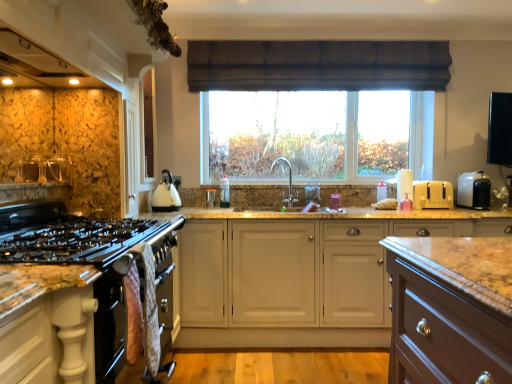
Question: Are white plastic toaster at right, the 2th appliance from the left, and brown fabric curtain at upper center located far from each other?

Choices:
 (A) no
 (B) yes

Answer: (B)

Question: Does white plastic toaster at right, marked as the first appliance in a right-to-left arrangement, have a lesser height compared to brown fabric curtain at upper center?

Choices:
 (A) yes
 (B) no

Answer: (A)

Question: Can you confirm if white plastic toaster at right, the 2th appliance from the left, is wider than brown fabric curtain at upper center?

Choices:
 (A) yes
 (B) no

Answer: (A)

Question: Is brown fabric curtain at upper center at the back of white plastic toaster at right, the 2th appliance from the left?

Choices:
 (A) yes
 (B) no

Answer: (B)

Question: Is white plastic toaster at right, the 2th appliance from the left, bigger than brown fabric curtain at upper center?

Choices:
 (A) yes
 (B) no

Answer: (B)

Question: Considering the positions of white matte cabinet at center, which is the 1th cabinetry from back to front, and yellow plastic toaster at right, the 1th appliance when ordered from left to right, in the image, is white matte cabinet at center, which is the 1th cabinetry from back to front, wider or thinner than yellow plastic toaster at right, the 1th appliance when ordered from left to right,?

Choices:
 (A) thin
 (B) wide

Answer: (B)

Question: Is white matte cabinet at center, arranged as the 2th cabinetry when viewed from the left, situated inside yellow plastic toaster at right, marked as the 2th appliance in a right-to-left arrangement, or outside?

Choices:
 (A) inside
 (B) outside

Answer: (B)

Question: Visually, is white matte cabinet at center, marked as the second cabinetry in a front-to-back arrangement, positioned to the left or to the right of yellow plastic toaster at right, the 1th appliance when ordered from left to right?

Choices:
 (A) right
 (B) left

Answer: (B)

Question: Considering the positions of point (186, 266) and point (418, 185), is point (186, 266) closer or farther from the camera than point (418, 185)?

Choices:
 (A) closer
 (B) farther

Answer: (A)

Question: Which is correct: white plastic toaster at right, marked as the first appliance in a right-to-left arrangement, is inside brown fabric curtain at upper center, or outside of it?

Choices:
 (A) inside
 (B) outside

Answer: (B)

Question: Does point (464, 205) appear closer or farther from the camera than point (230, 43)?

Choices:
 (A) farther
 (B) closer

Answer: (B)

Question: Considering the positions of white plastic toaster at right, marked as the first appliance in a right-to-left arrangement, and brown fabric curtain at upper center in the image, is white plastic toaster at right, marked as the first appliance in a right-to-left arrangement, taller or shorter than brown fabric curtain at upper center?

Choices:
 (A) tall
 (B) short

Answer: (B)

Question: Would you say white plastic toaster at right, the 2th appliance from the left, is to the left or to the right of brown fabric curtain at upper center in the picture?

Choices:
 (A) right
 (B) left

Answer: (A)

Question: Relative to white glossy kettle at center, is granite countertop at lower left in front or behind?

Choices:
 (A) behind
 (B) front

Answer: (B)

Question: Is granite countertop at lower left wider or thinner than white glossy kettle at center?

Choices:
 (A) thin
 (B) wide

Answer: (A)